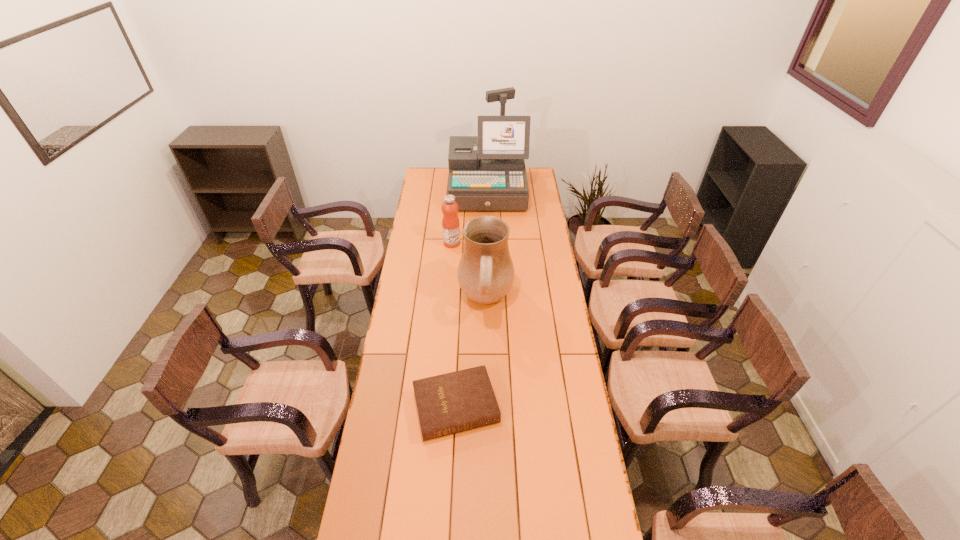
Locate an element on the screen. This screenshot has width=960, height=540. vacant region located at the spout of the cream pitcher is located at coordinates (412, 301).

At what (x,y) coordinates should I click in order to perform the action: click on vacant space situated at the spout of the cream pitcher. Please return your answer as a coordinate pair (x, y). Image resolution: width=960 pixels, height=540 pixels. Looking at the image, I should click on (401, 301).

Where is `vacant space situated on the front label of the fruit juice`? This screenshot has width=960, height=540. vacant space situated on the front label of the fruit juice is located at coordinates click(479, 243).

This screenshot has height=540, width=960. Identify the location of vacant space positioned 0.060m on the right of the Bible. (516, 407).

Where is `object at the far edge`? Image resolution: width=960 pixels, height=540 pixels. object at the far edge is located at coordinates (494, 179).

Where is `object that is positioned at the left edge`? This screenshot has width=960, height=540. object that is positioned at the left edge is located at coordinates (450, 403).

Locate an element on the screen. This screenshot has height=540, width=960. object present at the right edge is located at coordinates (494, 179).

At what (x,y) coordinates should I click in order to perform the action: click on object that is at the far right corner. Please return your answer as a coordinate pair (x, y). Looking at the image, I should click on (494, 179).

In the image, there is a desktop. At what (x,y) coordinates should I click in order to perform the action: click on vacant space at the left edge. Please return your answer as a coordinate pair (x, y). Looking at the image, I should click on (440, 218).

In the image, there is a desktop. Where is `vacant space at the right edge`? The width and height of the screenshot is (960, 540). vacant space at the right edge is located at coordinates (556, 515).